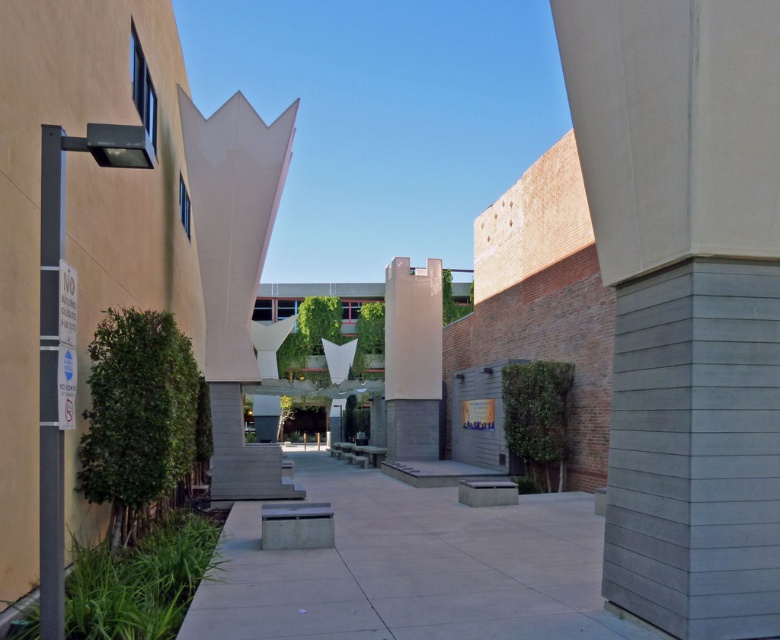
Question: Which of the following is the closest to the observer?

Choices:
 (A) (651, 20)
 (B) (250, 490)

Answer: (A)

Question: Estimate the real-world distances between objects in this image. Which object is farther from the smooth concrete pillar at center?

Choices:
 (A) gray concrete pillar at right
 (B) white concrete sculpture at center

Answer: (A)

Question: Can you confirm if gray concrete pillar at right is bigger than smooth concrete pillar at center?

Choices:
 (A) yes
 (B) no

Answer: (A)

Question: Among these points, which one is nearest to the camera?

Choices:
 (A) (215, 172)
 (B) (417, 307)

Answer: (A)

Question: Does white concrete sculpture at center appear under smooth concrete pillar at center?

Choices:
 (A) yes
 (B) no

Answer: (B)

Question: Can you confirm if gray concrete pillar at right is positioned to the right of white concrete sculpture at center?

Choices:
 (A) yes
 (B) no

Answer: (A)